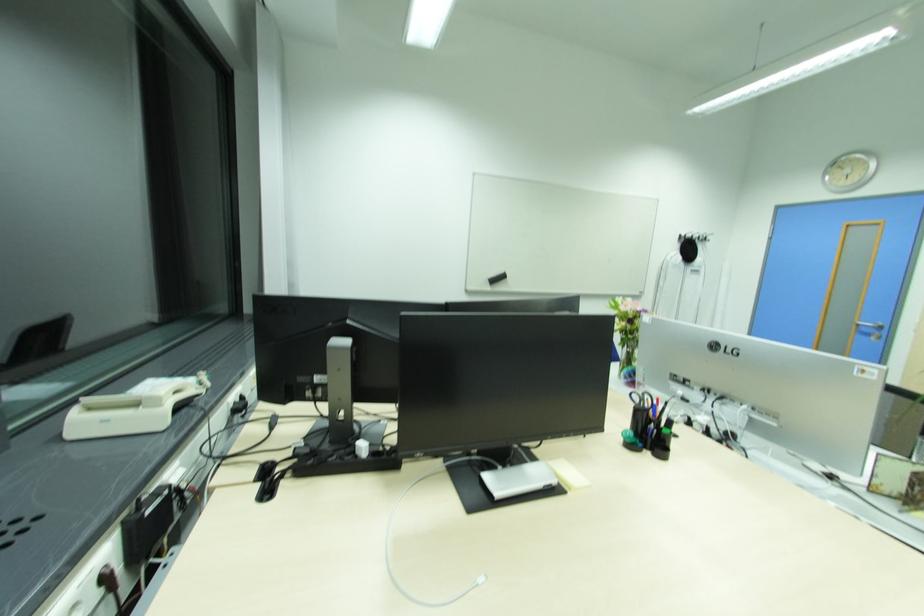
In order to click on white phone handset in this screenshot , I will do `click(132, 408)`.